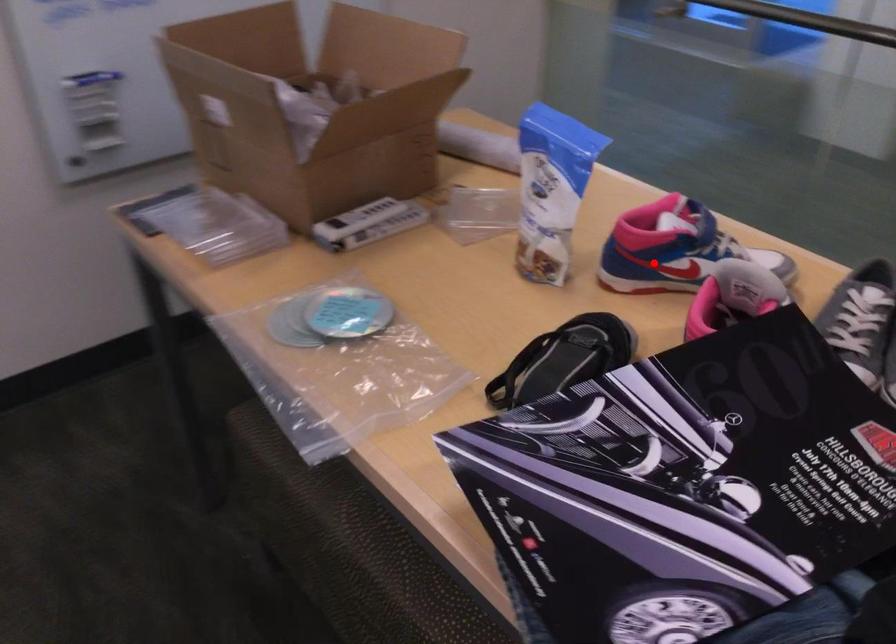
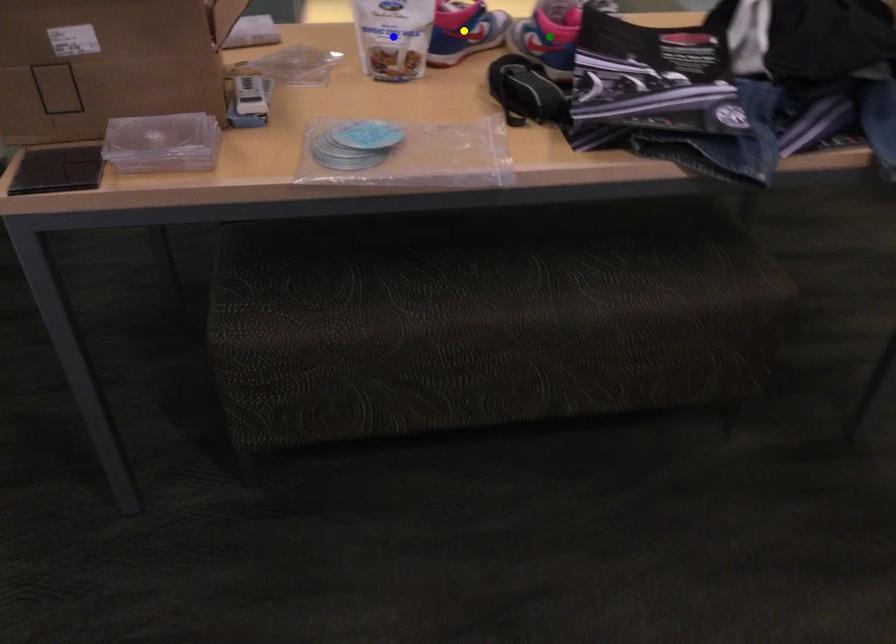
Question: I am providing you with two images of the same scene from different viewpoints. A red point is marked on the first image. You are given multiple points on the second image. Which point in image 2 represents the same 3d spot as the red point in image 1?

Choices:
 (A) yellow point
 (B) blue point
 (C) green point

Answer: (A)